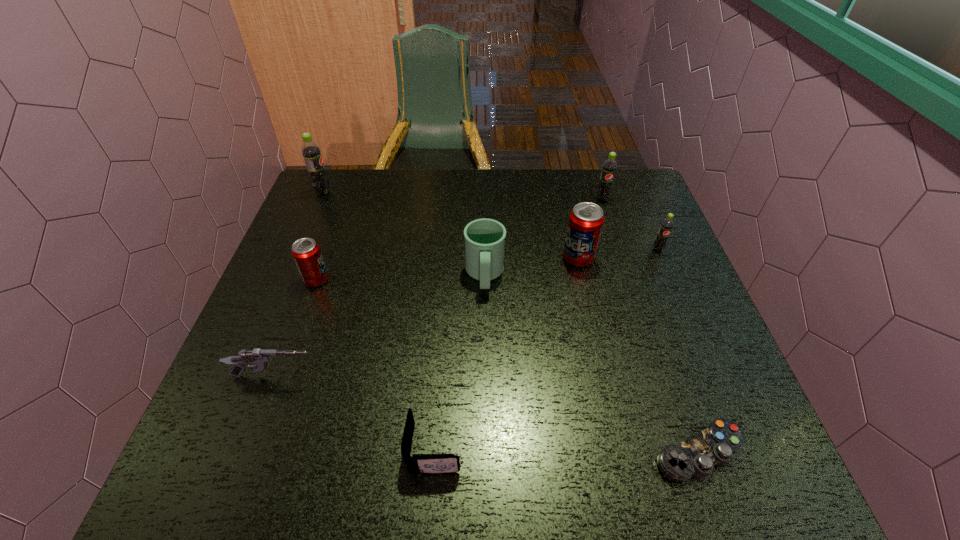
Image resolution: width=960 pixels, height=540 pixels. Identify the location of the tallest object. (311, 152).

At what (x,y) coordinates should I click in order to perform the action: click on the biggest green soda. Please return your answer as a coordinate pair (x, y). The height and width of the screenshot is (540, 960). Looking at the image, I should click on (311, 152).

This screenshot has width=960, height=540. Identify the location of the second biggest green soda. (609, 167).

Image resolution: width=960 pixels, height=540 pixels. I want to click on the second green soda from left to right, so 609,167.

You are a GUI agent. You are given a task and a screenshot of the screen. Output one action in this format:
    pyautogui.click(x=<x>, y=<y>)
    Task: Click on the right red soda can
    
    Given the screenshot: What is the action you would take?
    pyautogui.click(x=586, y=219)

Identify the location of the third soda can from right to left. The width and height of the screenshot is (960, 540). (586, 219).

Locate an element on the screen. The image size is (960, 540). green mug is located at coordinates [484, 238].

What are the coordinates of `the rightmost green soda` in the screenshot? It's located at (667, 224).

The width and height of the screenshot is (960, 540). Find the location of `the smallest green soda`. the smallest green soda is located at coordinates (667, 224).

The height and width of the screenshot is (540, 960). What are the coordinates of `the nearer red soda can` in the screenshot? It's located at point(306,252).